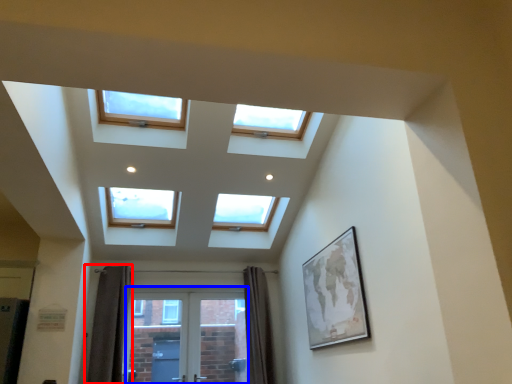
Question: Which object appears closest to the camera in this image, curtain (highlighted by a red box) or screen door (highlighted by a blue box)?

Choices:
 (A) curtain
 (B) screen door

Answer: (A)